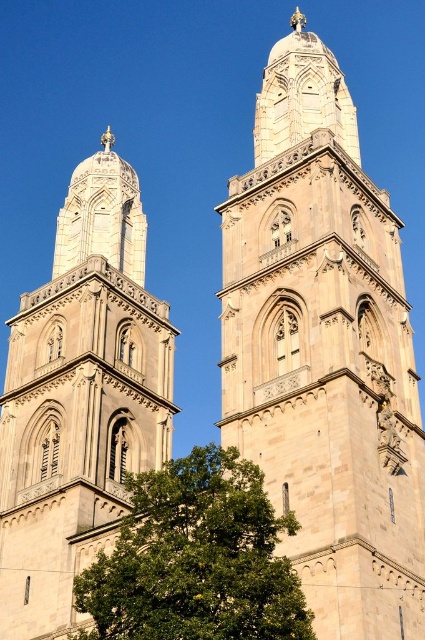
Who is positioned more to the right, beige stone tower at left or green leafy tree at lower left?

Positioned to the right is green leafy tree at lower left.

Can you confirm if beige stone tower at left is positioned below green leafy tree at lower left?

Incorrect, beige stone tower at left is not positioned below green leafy tree at lower left.

Is point (124, 236) closer to viewer compared to point (169, 468)?

No, it is behind (169, 468).

Locate an element on the screen. Image resolution: width=425 pixels, height=640 pixels. beige stone tower at left is located at coordinates (79, 397).

Does beige stone tower at center have a smaller size compared to green leafy tree at lower left?

Incorrect, beige stone tower at center is not smaller in size than green leafy tree at lower left.

Is beige stone tower at center above green leafy tree at lower left?

Indeed, beige stone tower at center is positioned over green leafy tree at lower left.

Locate an element on the screen. beige stone tower at center is located at coordinates tap(325, 349).

The width and height of the screenshot is (425, 640). I want to click on beige stone tower at center, so click(325, 349).

Can you confirm if beige stone tower at center is wider than beige stone tower at left?

No.

Is beige stone tower at center taller than beige stone tower at left?

Yes, beige stone tower at center is taller than beige stone tower at left.

Find the location of a particular element. This screenshot has height=640, width=425. beige stone tower at center is located at coordinates (325, 349).